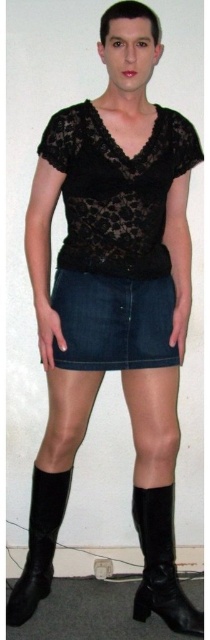
You are a fashion designer analyzing the outfit in the image. Based on the placement of the lace fabric top at center and the black leather boot at lower left, which item is covering part of the other?

The lace fabric top at center is positioned over the black leather boot at lower left, meaning the top is covering part of the boot.

You are a fashion designer trying to create a new outfit. You have a lace fabric top at center and a black leather boot at lower left in your design. Which item would require more fabric to produce?

The lace fabric top at center is bigger than the black leather boot at lower left, so it would require more fabric to produce.